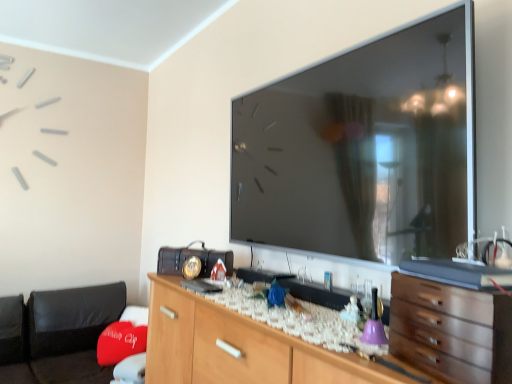
Question: Is metallic vintage radio at center touching wooden chest of drawers at lower right?

Choices:
 (A) yes
 (B) no

Answer: (B)

Question: Is metallic vintage radio at center looking in the opposite direction of wooden chest of drawers at lower right?

Choices:
 (A) no
 (B) yes

Answer: (A)

Question: Does metallic vintage radio at center have a greater height compared to wooden chest of drawers at lower right?

Choices:
 (A) yes
 (B) no

Answer: (B)

Question: Is wooden chest of drawers at lower right inside metallic vintage radio at center?

Choices:
 (A) yes
 (B) no

Answer: (B)

Question: Is metallic vintage radio at center closer to the viewer compared to wooden chest of drawers at lower right?

Choices:
 (A) yes
 (B) no

Answer: (B)

Question: Relative to red fabric bean bag at lower left, is metallic vintage radio at center in front or behind?

Choices:
 (A) behind
 (B) front

Answer: (A)

Question: Which is correct: metallic vintage radio at center is inside red fabric bean bag at lower left, or outside of it?

Choices:
 (A) outside
 (B) inside

Answer: (A)

Question: From the image's perspective, relative to red fabric bean bag at lower left, is metallic vintage radio at center above or below?

Choices:
 (A) below
 (B) above

Answer: (B)

Question: Is point (173, 261) closer or farther from the camera than point (40, 349)?

Choices:
 (A) farther
 (B) closer

Answer: (B)

Question: Considering the positions of red fabric bean bag at lower left and metallic vintage radio at center in the image, is red fabric bean bag at lower left bigger or smaller than metallic vintage radio at center?

Choices:
 (A) big
 (B) small

Answer: (A)

Question: Considering the positions of red fabric bean bag at lower left and metallic vintage radio at center in the image, is red fabric bean bag at lower left taller or shorter than metallic vintage radio at center?

Choices:
 (A) tall
 (B) short

Answer: (A)

Question: From the image's perspective, is red fabric bean bag at lower left positioned above or below metallic vintage radio at center?

Choices:
 (A) above
 (B) below

Answer: (B)

Question: Is red fabric bean bag at lower left in front of or behind metallic vintage radio at center in the image?

Choices:
 (A) front
 (B) behind

Answer: (A)

Question: In the image, is metallic vintage radio at center positioned in front of or behind wooden chest of drawers at lower right?

Choices:
 (A) front
 (B) behind

Answer: (B)

Question: From the image's perspective, is metallic vintage radio at center above or below wooden chest of drawers at lower right?

Choices:
 (A) above
 (B) below

Answer: (B)